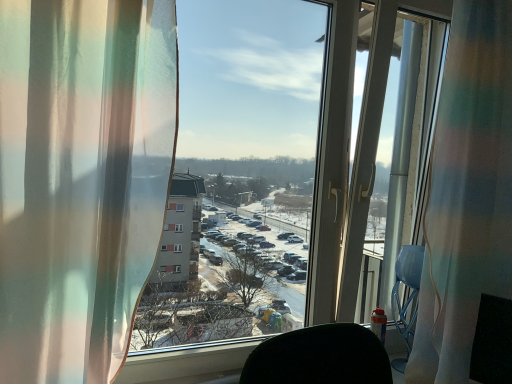
Question: Is translucent fabric at center facing away from translucent sheer curtain at left, which is the first curtain from front to back?

Choices:
 (A) yes
 (B) no

Answer: (B)

Question: Does translucent fabric at center lie behind translucent sheer curtain at left, which is the first curtain from front to back?

Choices:
 (A) no
 (B) yes

Answer: (B)

Question: Can you confirm if translucent fabric at center is shorter than translucent sheer curtain at left, the second curtain viewed from the right?

Choices:
 (A) yes
 (B) no

Answer: (B)

Question: Is translucent fabric at center wider than translucent sheer curtain at left, the second curtain viewed from the right?

Choices:
 (A) yes
 (B) no

Answer: (B)

Question: Is the position of translucent fabric at center less distant than that of translucent sheer curtain at left, which is the first curtain from front to back?

Choices:
 (A) no
 (B) yes

Answer: (A)

Question: Is translucent fabric curtain at right, arranged as the first curtain when viewed from the right, wider or thinner than translucent fabric at center?

Choices:
 (A) wide
 (B) thin

Answer: (A)

Question: From a real-world perspective, relative to translucent fabric at center, is translucent fabric curtain at right, positioned as the 2th curtain in left-to-right order, vertically above or below?

Choices:
 (A) below
 (B) above

Answer: (A)

Question: In terms of height, does translucent fabric curtain at right, which is the second curtain from front to back, look taller or shorter compared to translucent fabric at center?

Choices:
 (A) tall
 (B) short

Answer: (A)

Question: From the image's perspective, is translucent fabric curtain at right, which is the second curtain from front to back, positioned above or below translucent fabric at center?

Choices:
 (A) below
 (B) above

Answer: (A)

Question: From a real-world perspective, relative to translucent fabric curtain at right, which is the second curtain from front to back, is translucent sheer curtain at left, which is the first curtain from front to back, vertically above or below?

Choices:
 (A) below
 (B) above

Answer: (A)

Question: Do you think translucent sheer curtain at left, the second curtain viewed from the right, is within translucent fabric curtain at right, positioned as the 2th curtain in left-to-right order, or outside of it?

Choices:
 (A) outside
 (B) inside

Answer: (A)

Question: In terms of height, does translucent sheer curtain at left, the first curtain viewed from the left, look taller or shorter compared to translucent fabric curtain at right, which is the second curtain from front to back?

Choices:
 (A) tall
 (B) short

Answer: (B)

Question: Considering the positions of translucent sheer curtain at left, the second curtain viewed from the right, and translucent fabric curtain at right, which is the second curtain from front to back, in the image, is translucent sheer curtain at left, the second curtain viewed from the right, wider or thinner than translucent fabric curtain at right, which is the second curtain from front to back,?

Choices:
 (A) thin
 (B) wide

Answer: (B)

Question: In terms of height, does translucent sheer curtain at left, the first curtain viewed from the left, look taller or shorter compared to translucent fabric at center?

Choices:
 (A) tall
 (B) short

Answer: (B)

Question: Is translucent sheer curtain at left, which is the first curtain from front to back, inside or outside of translucent fabric at center?

Choices:
 (A) inside
 (B) outside

Answer: (B)